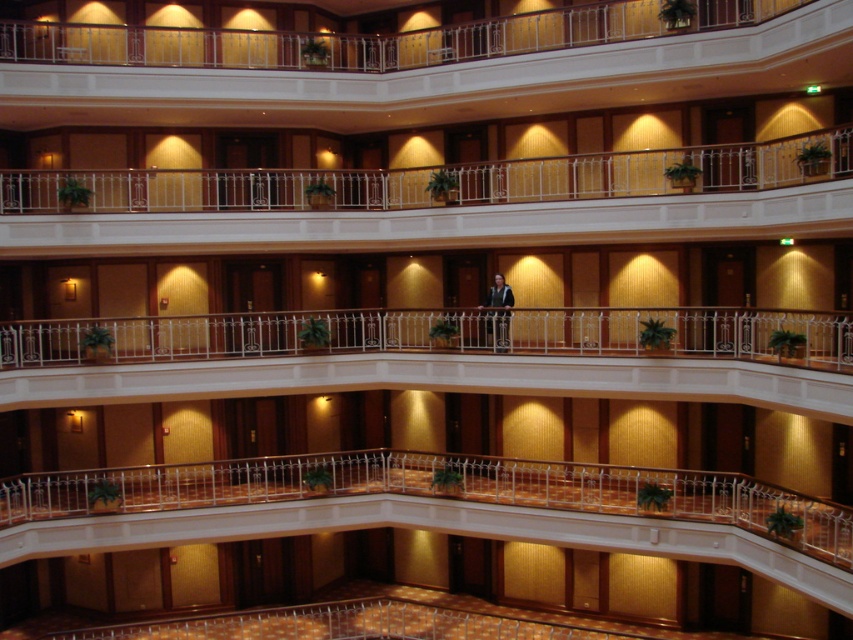
You are an interior designer assessing the space between the white glossy railing at center and the white metal railing at upper center. Which railing has a narrower width?

The white glossy railing at center has a lesser width compared to the white metal railing at upper center, so it is narrower.

Consider the image. You are standing in the multi story building and want to reach the point at coordinates (833,406). The building has railings every 10 feet. How many railings will you pass while moving towards that point?

The distance between you and the point is 34.94 feet. Since railings are placed every 10 feet, you will pass 3 railings on your way to the point.

You are standing in the lobby of this building and want to reach the upper floor via the railings. Which railing, the white glossy railing at center or the white metal railing at upper center, is closer to you as you approach the staircase?

The white glossy railing at center is closer to the viewer than the white metal railing at upper center, so the white glossy railing at center is closer to you as you approach the staircase.